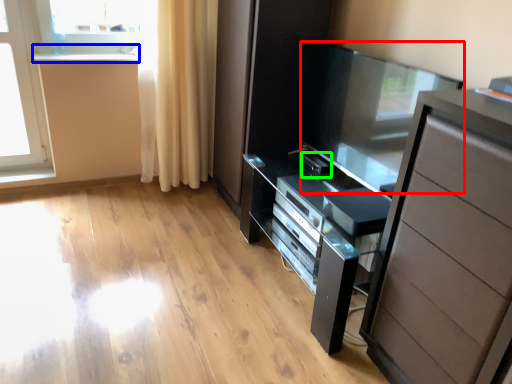
Question: Considering the real-world distances, which object is closest to screen door (highlighted by a red box)? window sill (highlighted by a blue box) or appliance (highlighted by a green box).

Choices:
 (A) window sill
 (B) appliance

Answer: (B)